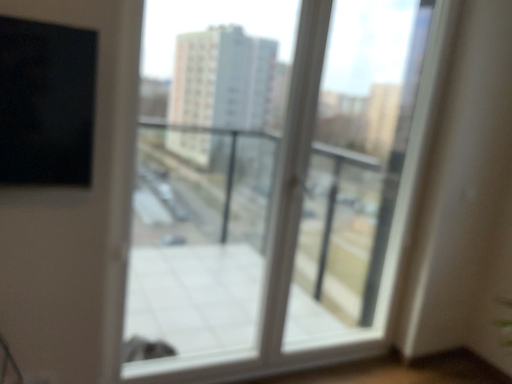
What do you see at coordinates (274, 182) in the screenshot?
I see `transparent glass window at center` at bounding box center [274, 182].

This screenshot has height=384, width=512. I want to click on transparent glass window at center, so click(x=274, y=182).

Describe the element at coordinates (356, 173) in the screenshot. I see `white plastic screen door at center` at that location.

What is the approximate width of white plastic screen door at center?

white plastic screen door at center is 3.71 inches in width.

You are a GUI agent. You are given a task and a screenshot of the screen. Output one action in this format:
    pyautogui.click(x=<x>, y=<y>)
    Task: Click on the white plastic screen door at center
    The width and height of the screenshot is (512, 384).
    Given the screenshot: What is the action you would take?
    pyautogui.click(x=356, y=173)

The height and width of the screenshot is (384, 512). Identify the location of transparent glass window at center. (274, 182).

Considering the positions of objects white plastic screen door at center and transparent glass window at center in the image provided, who is more to the right, white plastic screen door at center or transparent glass window at center?

white plastic screen door at center is more to the right.

Which object is closer to the camera taking this photo, white plastic screen door at center or transparent glass window at center?

Positioned in front is transparent glass window at center.

Which is further, (305, 299) or (122, 355)?

The point (305, 299) is more distant.

From the image's perspective, is white plastic screen door at center beneath transparent glass window at center?

Yes.

From a real-world perspective, is white plastic screen door at center positioned above or below transparent glass window at center?

white plastic screen door at center is above transparent glass window at center.

Which of these two, white plastic screen door at center or transparent glass window at center, is thinner?

white plastic screen door at center.

Is white plastic screen door at center shorter than transparent glass window at center?

Correct, white plastic screen door at center is not as tall as transparent glass window at center.

Looking at the image, does white plastic screen door at center seem bigger or smaller compared to transparent glass window at center?

Considering their sizes, white plastic screen door at center takes up less space than transparent glass window at center.

From the picture: Do you think white plastic screen door at center is within transparent glass window at center, or outside of it?

white plastic screen door at center is inside transparent glass window at center.

Consider the image. Is white plastic screen door at center placed right next to transparent glass window at center?

They are not placed beside each other.

Is transparent glass window at center at the back of white plastic screen door at center?

Yes.

How many degrees apart are the facing directions of white plastic screen door at center and transparent glass window at center?

The facing directions of white plastic screen door at center and transparent glass window at center are 2.75 degrees apart.

How far apart are white plastic screen door at center and transparent glass window at center?

white plastic screen door at center is 40.27 centimeters from transparent glass window at center.

The image size is (512, 384). In the image, there is a white plastic screen door at center. In order to click on window above it (from the image's perspective) in this screenshot , I will do (x=274, y=182).

Does transparent glass window at center appear on the left side of white plastic screen door at center?

Correct, you'll find transparent glass window at center to the left of white plastic screen door at center.

Is transparent glass window at center positioned before white plastic screen door at center?

Yes, the depth of transparent glass window at center is less than that of white plastic screen door at center.

Is point (390, 199) positioned behind point (355, 66)?

No, (390, 199) is in front of (355, 66).

From the image's perspective, is transparent glass window at center on white plastic screen door at center?

→ Yes.

From a real-world perspective, which object rests below the other?

In real-world perspective, transparent glass window at center is lower.

Considering the relative sizes of transparent glass window at center and white plastic screen door at center in the image provided, is transparent glass window at center thinner than white plastic screen door at center?

No, transparent glass window at center is not thinner than white plastic screen door at center.

From the picture: Between transparent glass window at center and white plastic screen door at center, which one has more height?

With more height is transparent glass window at center.

Considering the relative sizes of transparent glass window at center and white plastic screen door at center in the image provided, is transparent glass window at center bigger than white plastic screen door at center?

Correct, transparent glass window at center is larger in size than white plastic screen door at center.

Choose the correct answer: Is transparent glass window at center inside white plastic screen door at center or outside it?

The correct answer is: outside.

Is transparent glass window at center far away from white plastic screen door at center?

No, there isn't a large distance between transparent glass window at center and white plastic screen door at center.

Could you tell me if transparent glass window at center is turned towards white plastic screen door at center?

Yes, transparent glass window at center is facing white plastic screen door at center.

What's the angular difference between transparent glass window at center and white plastic screen door at center's facing directions?

2.75 degrees.

Find the location of a particular element. Image resolution: width=512 pixels, height=384 pixels. window below the white plastic screen door at center (from a real-world perspective) is located at coordinates (274, 182).

I want to click on screen door below the transparent glass window at center (from the image's perspective), so click(356, 173).

Find the location of `screen door that appears behind the transparent glass window at center`. screen door that appears behind the transparent glass window at center is located at coordinates (356, 173).